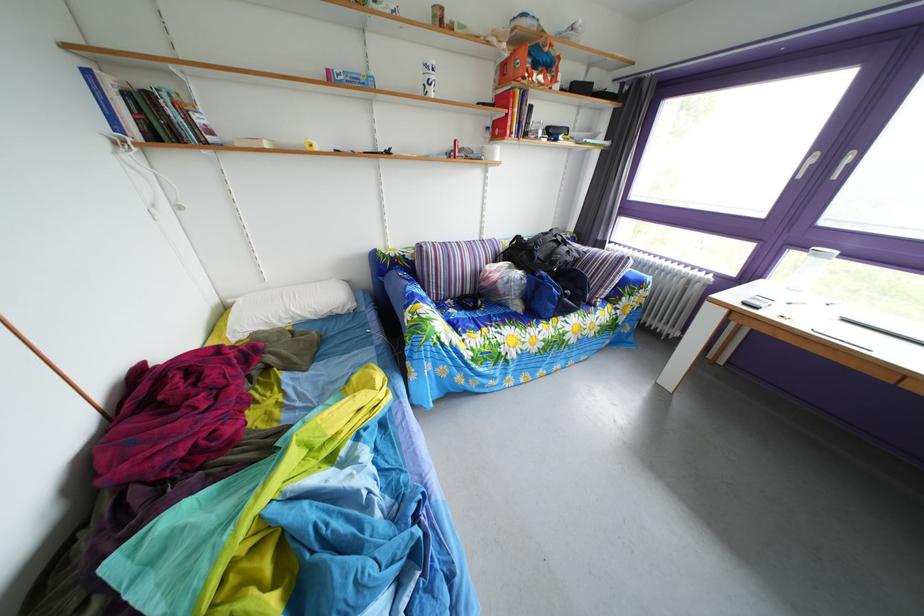
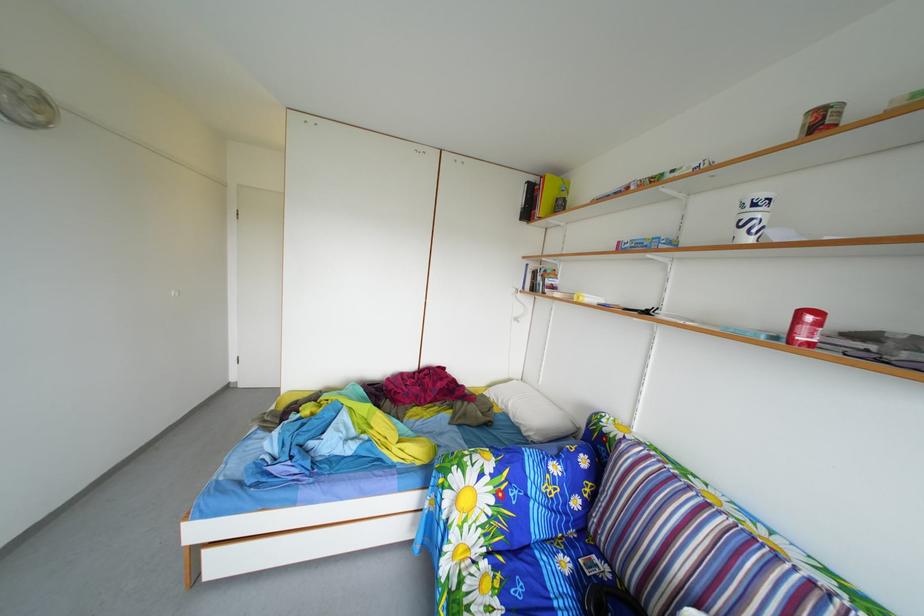
In the second image, find the point that corresponds to point (444, 78) in the first image.

(766, 214)